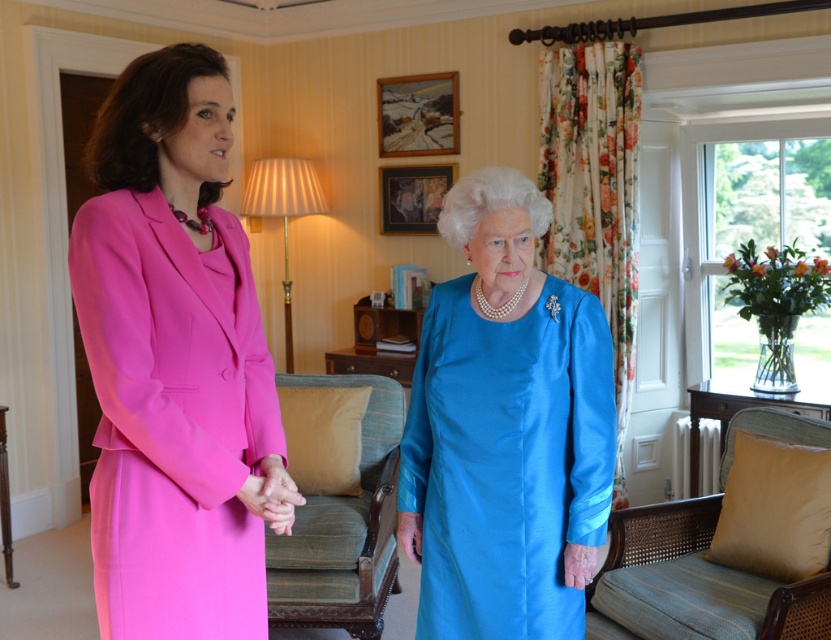
You are a photographer positioned in front of the two individuals. You need to focus your camera on the closer dress between the satin blue dress at center and the matte pink dress at center. Which dress should you focus on?

The satin blue dress at center is closer to the viewer than the matte pink dress at center, so you should focus on the satin blue dress at center.